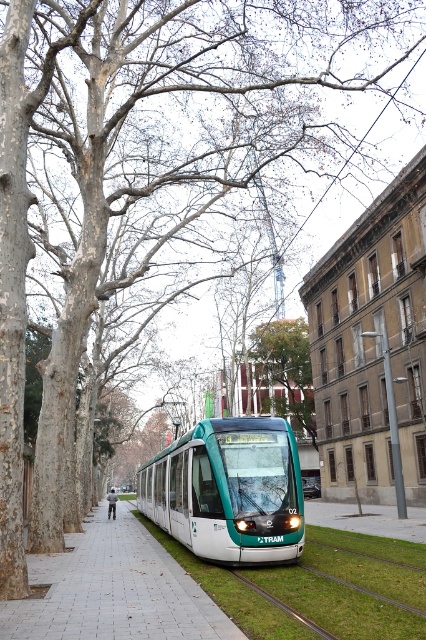
Question: Is teal glossy tram at center to the left of white tile pavement at center from the viewer's perspective?

Choices:
 (A) yes
 (B) no

Answer: (B)

Question: Is teal glossy tram at center thinner than green matte coach at center?

Choices:
 (A) yes
 (B) no

Answer: (A)

Question: Among these objects, which one is nearest to the camera?

Choices:
 (A) teal glossy tram at center
 (B) green matte coach at center

Answer: (A)

Question: Which is farther from the green matte coach at center?

Choices:
 (A) white tile pavement at center
 (B) teal glossy tram at center
 (C) green leafy tree at center

Answer: (C)

Question: Which point appears closest to the camera in this image?

Choices:
 (A) (227, 500)
 (B) (108, 502)
 (C) (301, 400)
 (D) (232, 627)

Answer: (D)

Question: Is teal glossy tram at center positioned behind white tile pavement at center?

Choices:
 (A) yes
 (B) no

Answer: (A)